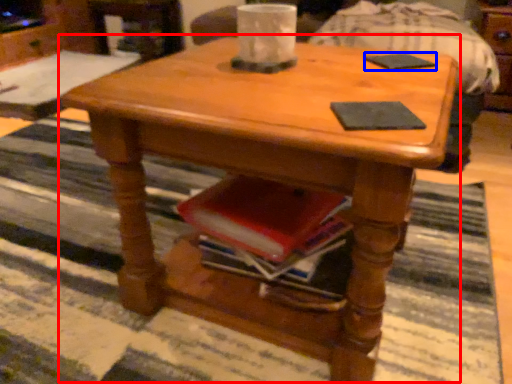
Question: Which of the following is the closest to the observer, coffee table (highlighted by a red box) or pad (highlighted by a blue box)?

Choices:
 (A) coffee table
 (B) pad

Answer: (A)